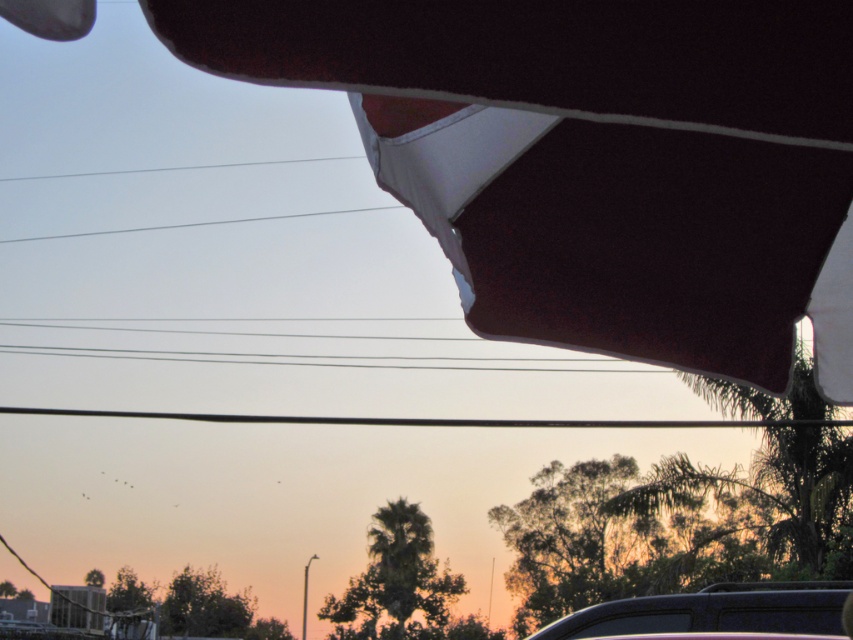
Which is more to the right, shiny black car at lower right or clear wire at upper center?

shiny black car at lower right

Is shiny black car at lower right above clear wire at upper center?

Actually, shiny black car at lower right is below clear wire at upper center.

This screenshot has width=853, height=640. I want to click on shiny black car at lower right, so click(712, 611).

Is black wire at center wider than clear wire at upper center?

Indeed, black wire at center has a greater width compared to clear wire at upper center.

Who is positioned more to the left, black wire at center or clear wire at upper center?

From the viewer's perspective, clear wire at upper center appears more on the left side.

This screenshot has width=853, height=640. Describe the element at coordinates (434, 419) in the screenshot. I see `black wire at center` at that location.

Where is `black wire at center`? black wire at center is located at coordinates (434, 419).

This screenshot has height=640, width=853. What are the coordinates of `shiny black car at lower right` in the screenshot? It's located at (712, 611).

Which is more to the right, shiny black car at lower right or black wire at center?

shiny black car at lower right is more to the right.

Locate an element on the screen. Image resolution: width=853 pixels, height=640 pixels. shiny black car at lower right is located at coordinates (712, 611).